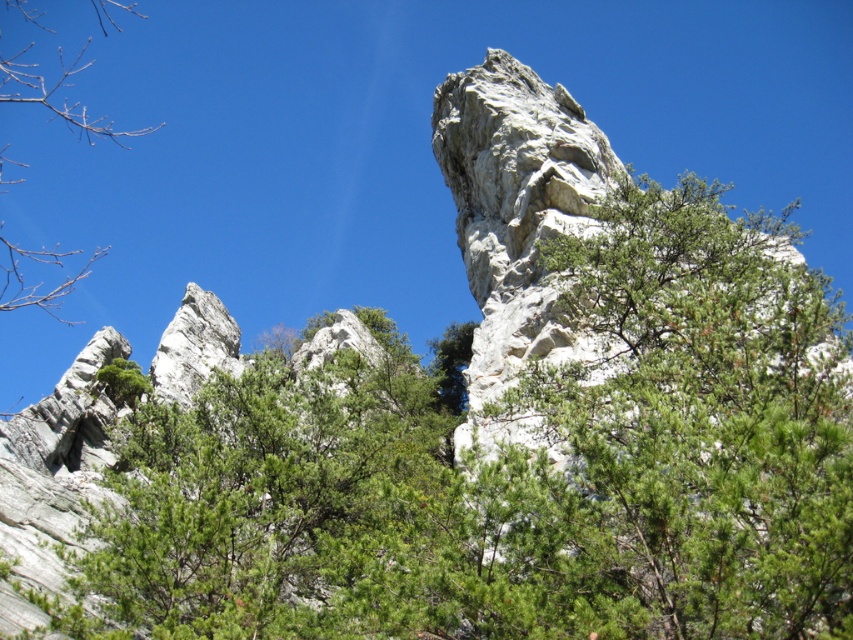
Question: Is green leafy tree at upper center positioned in front of green leafy tree at upper right?

Choices:
 (A) yes
 (B) no

Answer: (B)

Question: Estimate the real-world distances between objects in this image. Which object is closer to the green leafy tree at left?

Choices:
 (A) green leafy tree at upper right
 (B) green leafy tree at upper center

Answer: (B)

Question: Can you confirm if green leafy tree at upper right is positioned below green leafy tree at left?

Choices:
 (A) no
 (B) yes

Answer: (B)

Question: Where is green leafy tree at upper right located in relation to green leafy tree at left in the image?

Choices:
 (A) below
 (B) above

Answer: (A)

Question: Which object is farther from the camera taking this photo?

Choices:
 (A) green leafy tree at left
 (B) green leafy tree at upper right

Answer: (A)

Question: Among these points, which one is farthest from the camera?

Choices:
 (A) (9, 84)
 (B) (590, 548)
 (C) (595, 525)

Answer: (A)